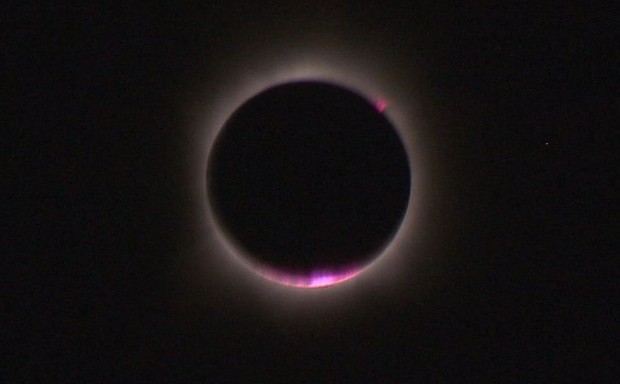
This screenshot has height=384, width=620. I want to click on pink light, so click(x=343, y=276).